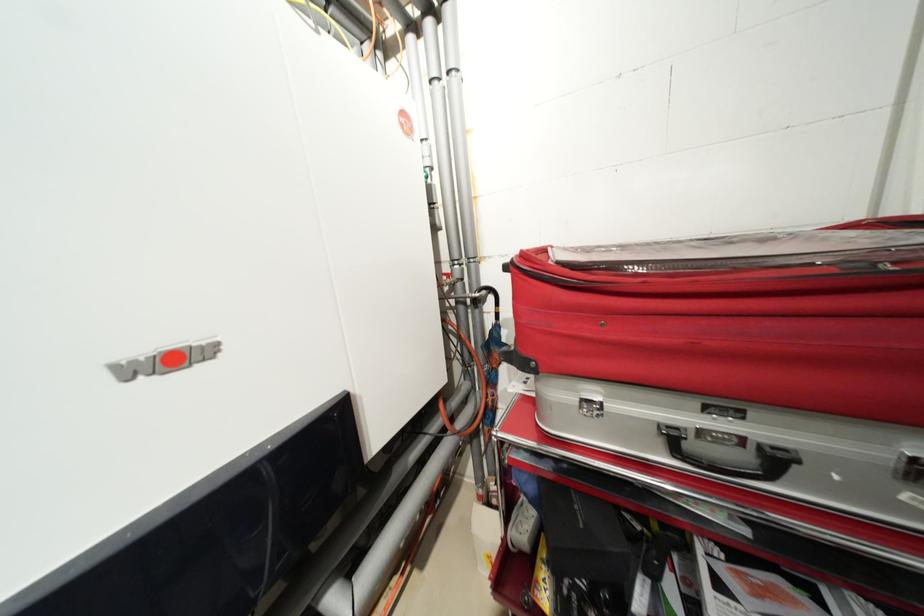
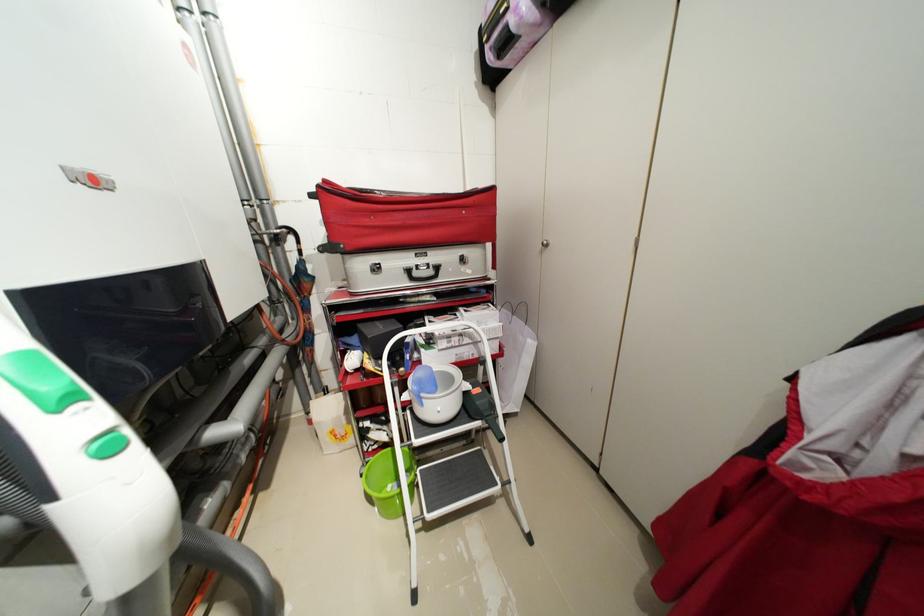
Find the pixel in the second image that matches pixel 530 256 in the first image.

(332, 182)